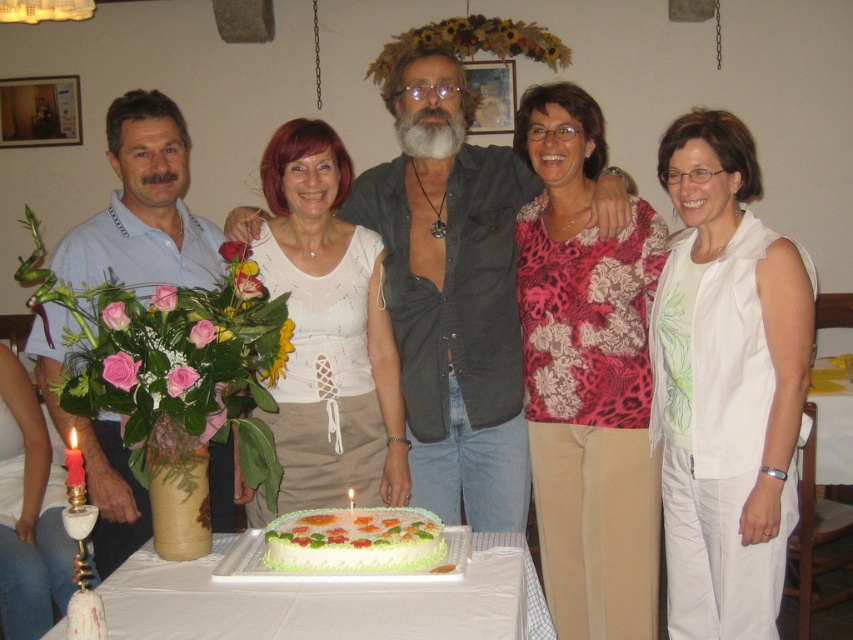
You are a photographer taking a picture of the dark gray shirt at center and the white frosted cake at center. Which one is positioned higher in the frame?

The dark gray shirt at center is above the white frosted cake at center, so it is positioned higher in the frame.

You are organizing a photo shoot and want to ensure proper lighting for the subjects. Since the floral print blouse at center and the dark gray shirt at center are both at the center, which one is closer to the camera to receive more light?

The floral print blouse at center is in front of the dark gray shirt at center, so it is closer to the camera and will receive more light.